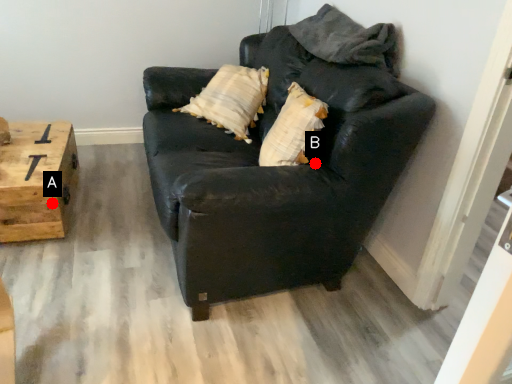
Question: Two points are circled on the image, labeled by A and B beside each circle. Which point is closer to the camera?

Choices:
 (A) A is closer
 (B) B is closer

Answer: (B)